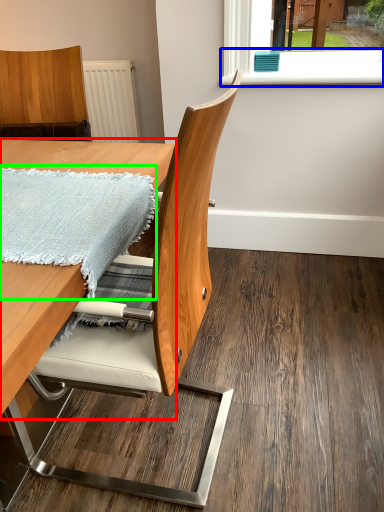
Question: Which object is positioned farthest from table (highlighted by a red box)? Select from window sill (highlighted by a blue box) and blanket (highlighted by a green box).

Choices:
 (A) window sill
 (B) blanket

Answer: (A)